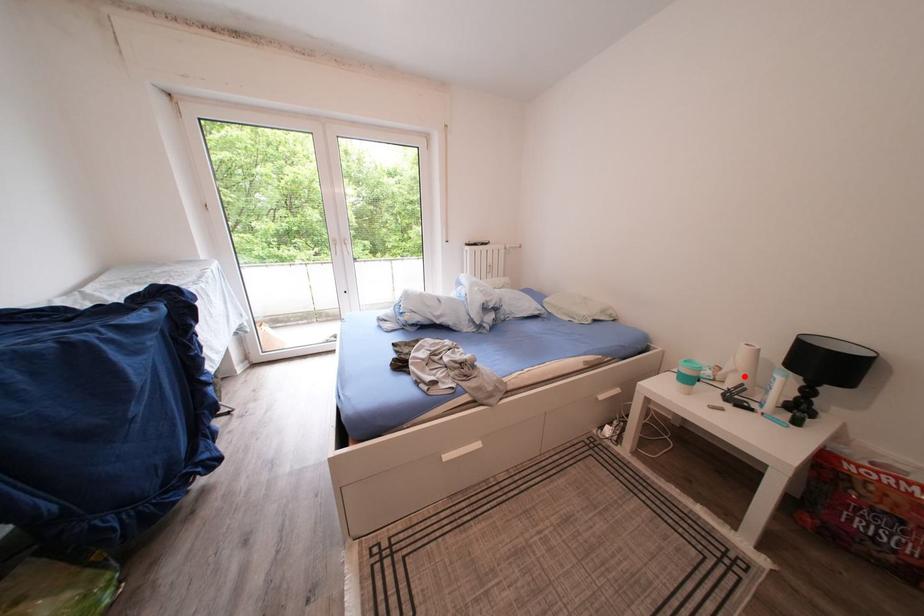
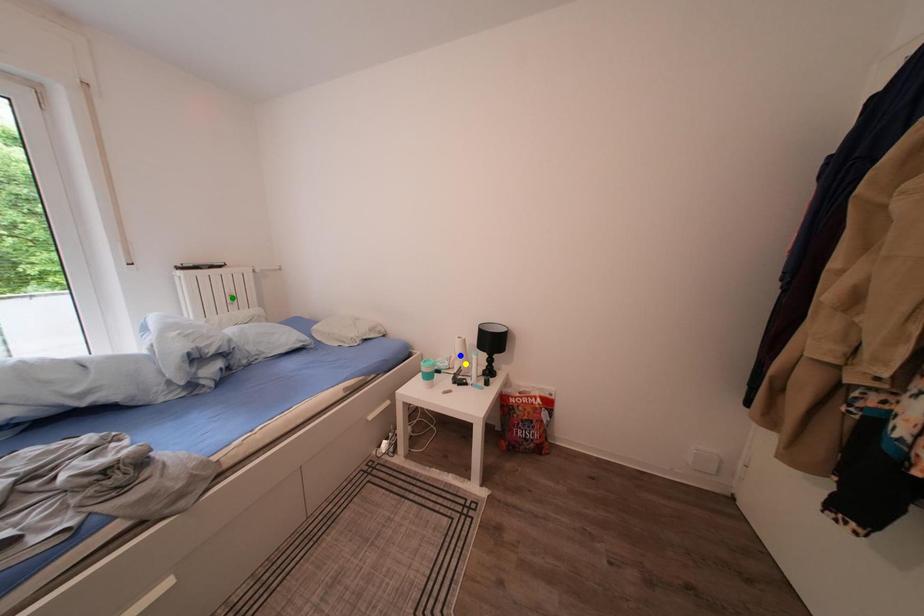
Question: I am providing you with two images of the same scene from different viewpoints. A red point is marked on the first image. You are given multiple points on the second image. Which mark in image 2 goes with the point in image 1?

Choices:
 (A) green point
 (B) blue point
 (C) yellow point

Answer: (C)